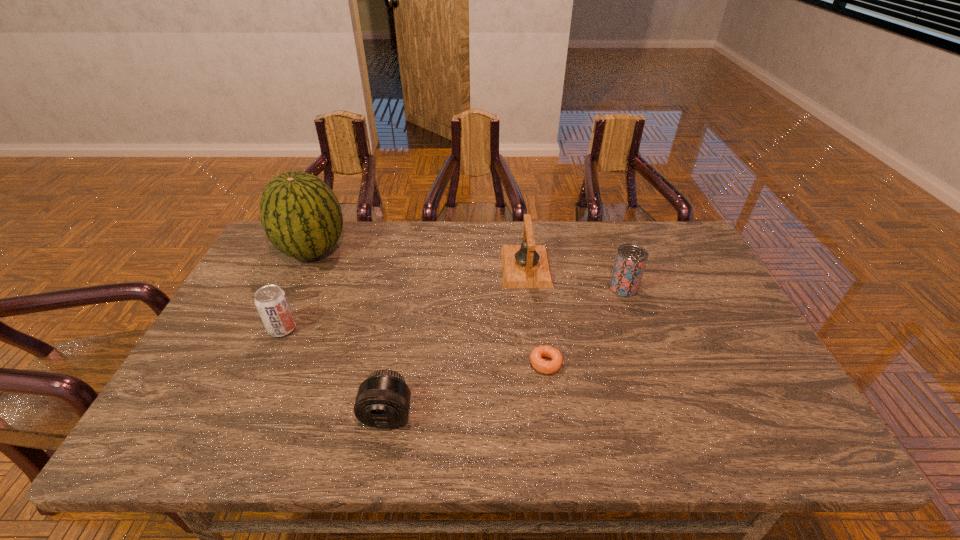
In the image, there is a desktop. In order to click on blank space at the near edge in this screenshot , I will do `click(524, 450)`.

Find the location of a particular element. The width and height of the screenshot is (960, 540). free location at the right edge is located at coordinates (751, 395).

Where is `free space at the far right corner of the desktop`? free space at the far right corner of the desktop is located at coordinates (663, 258).

You are a GUI agent. You are given a task and a screenshot of the screen. Output one action in this format:
    pyautogui.click(x=<x>, y=<y>)
    Task: Click on the vacant area between the watermelon and the fifth farthest object
    
    Given the screenshot: What is the action you would take?
    pyautogui.click(x=429, y=307)

The height and width of the screenshot is (540, 960). Find the location of `vacant space that's between the tallest object and the fourth farthest object`. vacant space that's between the tallest object and the fourth farthest object is located at coordinates (298, 289).

At what (x,y) coordinates should I click in order to perform the action: click on free spot between the fourth farthest object and the shortest object. Please return your answer as a coordinate pair (x, y). The width and height of the screenshot is (960, 540). Looking at the image, I should click on (414, 346).

Where is `vacant area that lies between the beer can and the tallest object`? The width and height of the screenshot is (960, 540). vacant area that lies between the beer can and the tallest object is located at coordinates (468, 269).

Image resolution: width=960 pixels, height=540 pixels. Identify the location of free space between the bell and the doughnut. coord(536,315).

I want to click on vacant point located between the third nearest object and the shortest object, so click(x=414, y=346).

This screenshot has height=540, width=960. Find the location of `free space between the bell and the third object from left to right`. free space between the bell and the third object from left to right is located at coordinates (457, 340).